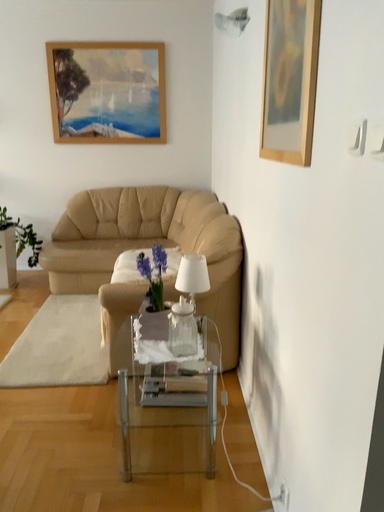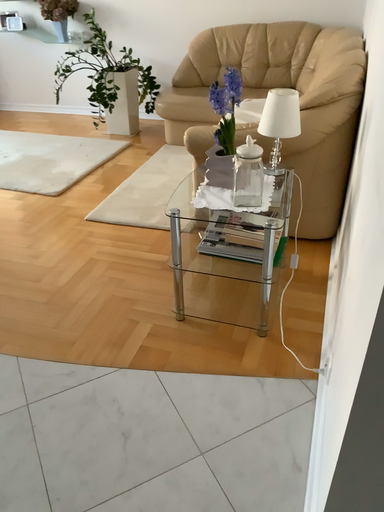
Question: Which way did the camera rotate in the video?

Choices:
 (A) rotated upward
 (B) rotated downward

Answer: (B)